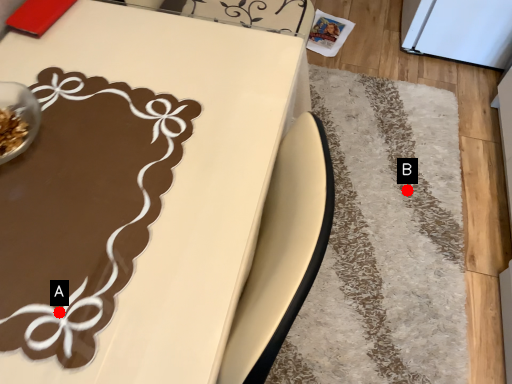
Question: Two points are circled on the image, labeled by A and B beside each circle. Which point is farther to the camera?

Choices:
 (A) A is further
 (B) B is further

Answer: (B)